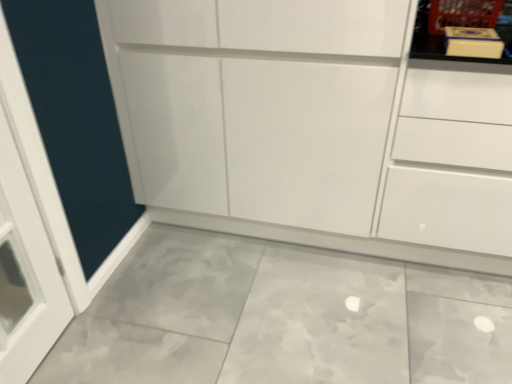
Question: Is white glossy cupboard at center wider than white glossy drawer at upper right?

Choices:
 (A) yes
 (B) no

Answer: (A)

Question: Is white glossy cupboard at center to the right of white glossy drawer at upper right from the viewer's perspective?

Choices:
 (A) yes
 (B) no

Answer: (B)

Question: Is white glossy cupboard at center looking in the opposite direction of white glossy drawer at upper right?

Choices:
 (A) no
 (B) yes

Answer: (A)

Question: From a real-world perspective, is white glossy cupboard at center below white glossy drawer at upper right?

Choices:
 (A) no
 (B) yes

Answer: (A)

Question: Could you tell me if white glossy cupboard at center is facing white glossy drawer at upper right?

Choices:
 (A) no
 (B) yes

Answer: (A)

Question: From a real-world perspective, is white glossy drawer at upper right positioned above or below matte yellow book at upper right?

Choices:
 (A) above
 (B) below

Answer: (B)

Question: Is white glossy drawer at upper right spatially inside matte yellow book at upper right, or outside of it?

Choices:
 (A) outside
 (B) inside

Answer: (A)

Question: From the image's perspective, is white glossy drawer at upper right located above or below matte yellow book at upper right?

Choices:
 (A) above
 (B) below

Answer: (B)

Question: Looking at the image, does white glossy drawer at upper right seem bigger or smaller compared to matte yellow book at upper right?

Choices:
 (A) small
 (B) big

Answer: (B)

Question: Is white glossy cupboard at center in front of or behind matte yellow book at upper right in the image?

Choices:
 (A) front
 (B) behind

Answer: (A)

Question: Considering the positions of point (224, 61) and point (416, 21), is point (224, 61) closer or farther from the camera than point (416, 21)?

Choices:
 (A) farther
 (B) closer

Answer: (A)

Question: Is white glossy cupboard at center wider or thinner than matte yellow book at upper right?

Choices:
 (A) wide
 (B) thin

Answer: (A)

Question: Looking at the image, does white glossy cupboard at center seem bigger or smaller compared to matte yellow book at upper right?

Choices:
 (A) small
 (B) big

Answer: (B)

Question: In terms of width, does matte yellow book at upper right look wider or thinner when compared to white glossy cupboard at center?

Choices:
 (A) wide
 (B) thin

Answer: (B)

Question: Is point (437, 57) closer or farther from the camera than point (280, 162)?

Choices:
 (A) farther
 (B) closer

Answer: (B)